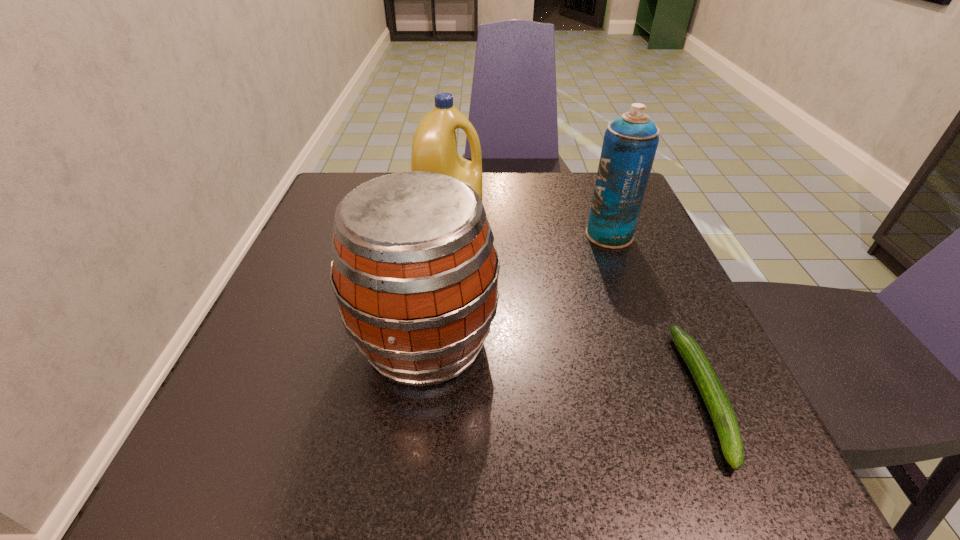
Where is `free spot between the cider and the aerosol can`? The width and height of the screenshot is (960, 540). free spot between the cider and the aerosol can is located at coordinates tap(517, 288).

This screenshot has width=960, height=540. In order to click on blank region between the detergent and the zucchini in this screenshot , I will do `click(577, 308)`.

Find the location of `vacant space that's between the zucchini and the aerosol can`. vacant space that's between the zucchini and the aerosol can is located at coordinates (657, 315).

Where is `empty space that is in between the detergent and the aerosol can`? Image resolution: width=960 pixels, height=540 pixels. empty space that is in between the detergent and the aerosol can is located at coordinates point(530,228).

Find the location of a particular element. free space between the zucchini and the detergent is located at coordinates (577, 308).

This screenshot has height=540, width=960. Find the location of `unoccupied position between the detergent and the aerosol can`. unoccupied position between the detergent and the aerosol can is located at coordinates (530, 228).

Where is `free space between the cider and the aerosol can`? This screenshot has width=960, height=540. free space between the cider and the aerosol can is located at coordinates point(517,288).

What are the coordinates of `free point between the zucchini and the cider` in the screenshot? It's located at (564, 368).

Locate an element on the screen. This screenshot has height=540, width=960. the second closest object to the zucchini is located at coordinates (415, 272).

Locate which object ranks in proximity to the shortest object. Please provide its 2D coordinates. Your answer should be formatted as a tuple, i.e. [(x, y)], where the tuple contains the x and y coordinates of a point satisfying the conditions above.

[(630, 142)]